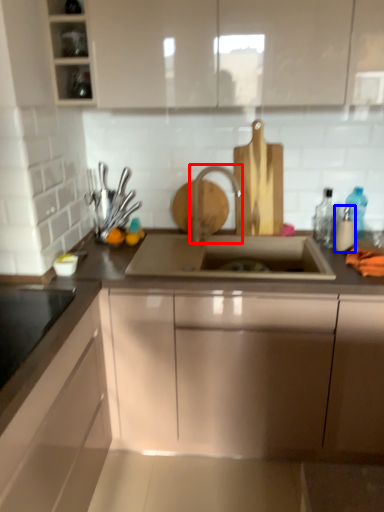
Question: Which point is further to the camera, tap (highlighted by a red box) or bottle (highlighted by a blue box)?

Choices:
 (A) tap
 (B) bottle

Answer: (A)